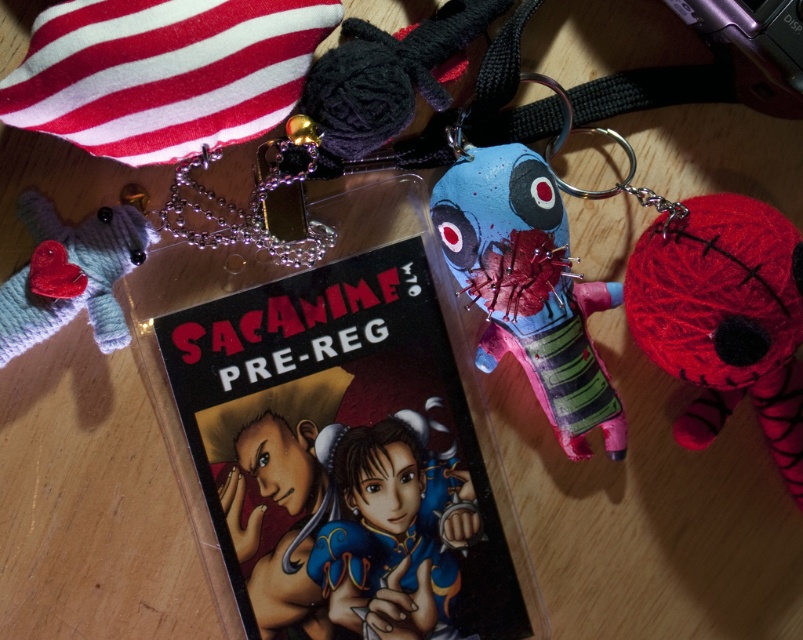
You are organizing items on a desk and need to place a matte plastic book exactly at point (345, 452). Is there already an object occupying that location?

Yes, the matte plastic book at center is already located at point (345, 452).

You are standing at the point marked as point (x=698, y=316). You want to place a 12 inch ruler horizontally on the wooden surface so that it extends from your current position to the right. Will the ruler fit entirely on the surface without going off the edge?

The ruler will fit entirely on the surface because the distance from point (x=698, y=316) to the right edge is more than 12 inches.